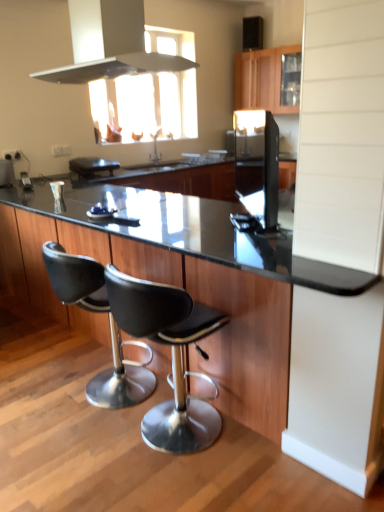
You are a GUI agent. You are given a task and a screenshot of the screen. Output one action in this format:
    pyautogui.click(x=<x>, y=<y>)
    Task: Click on the free space to the back side of black leather stool at center, placed as the first chair when sorted from left to right
    Image resolution: width=384 pixels, height=512 pixels.
    Given the screenshot: What is the action you would take?
    pos(81,354)